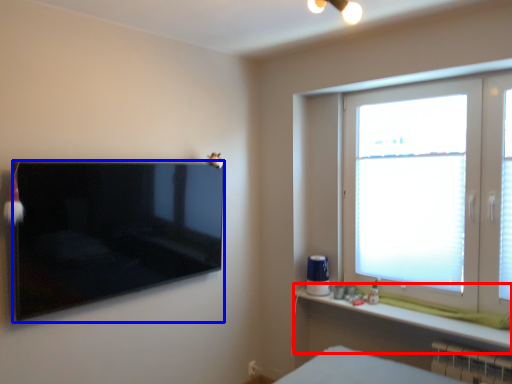
Question: Which object appears closest to the camera in this image, window sill (highlighted by a red box) or television (highlighted by a blue box)?

Choices:
 (A) window sill
 (B) television

Answer: (B)